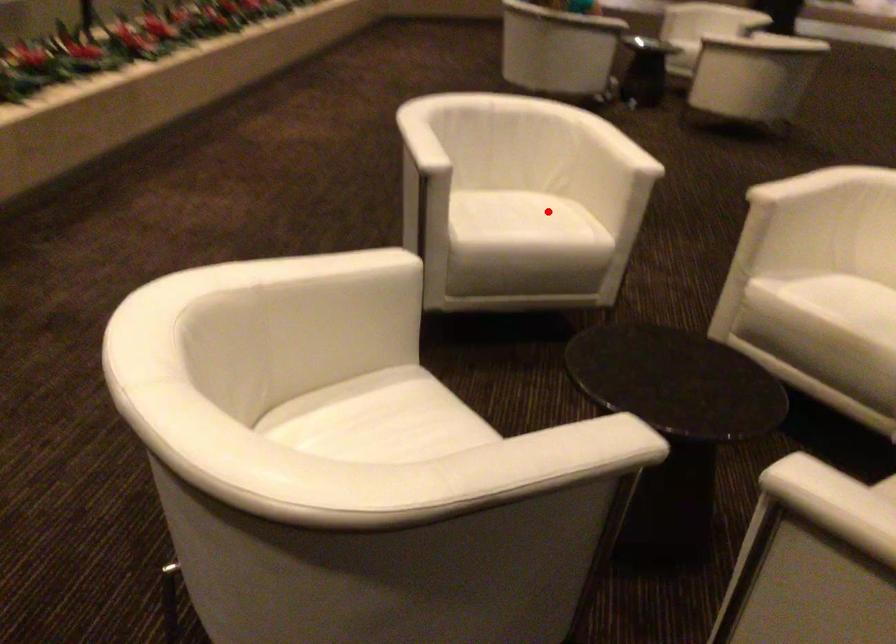
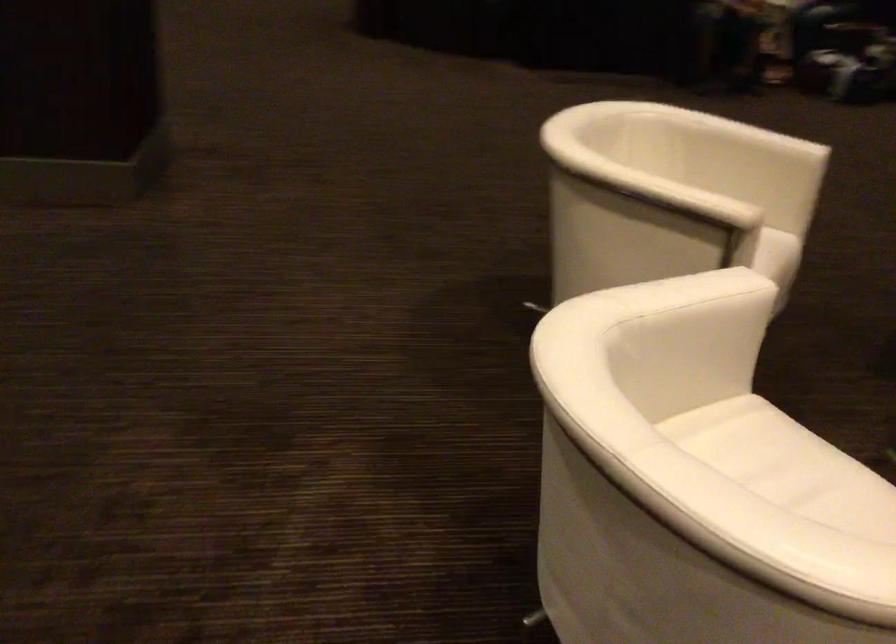
Locate, in the second image, the point that corresponds to the highlighted location in the first image.

(767, 453)